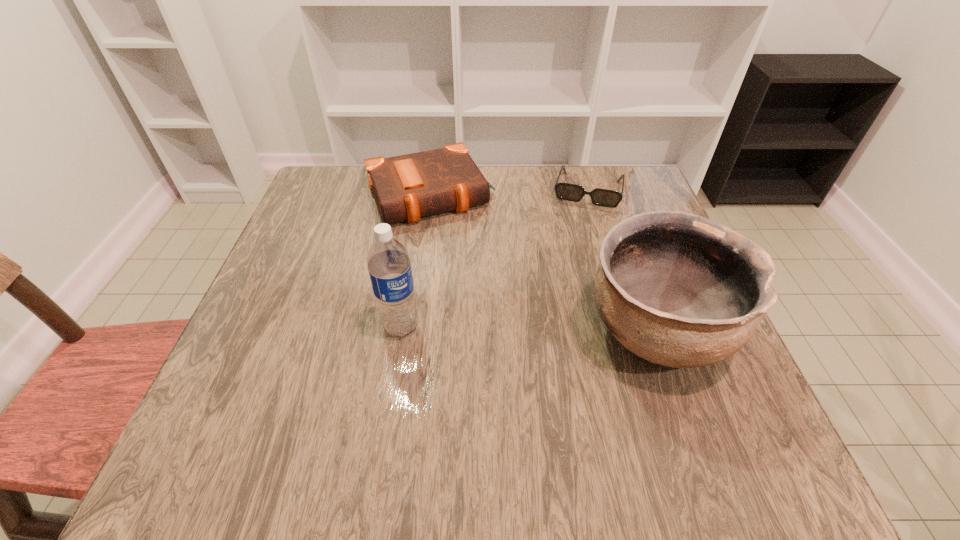
The image size is (960, 540). I want to click on object present at the near right corner, so click(677, 289).

Find the location of a particular element. The height and width of the screenshot is (540, 960). vacant space at the far edge is located at coordinates (560, 204).

At what (x,y) coordinates should I click in order to perform the action: click on vacant space at the left edge of the desktop. Please return your answer as a coordinate pair (x, y). The height and width of the screenshot is (540, 960). Looking at the image, I should click on (280, 318).

Image resolution: width=960 pixels, height=540 pixels. In the image, there is a desktop. Identify the location of vacant area at the far left corner. (341, 171).

At what (x,y) coordinates should I click in order to perform the action: click on vacant space at the near right corner of the desktop. Please return your answer as a coordinate pair (x, y). Looking at the image, I should click on (713, 413).

Where is `vacant point located between the third tallest object and the third shortest object`? vacant point located between the third tallest object and the third shortest object is located at coordinates (543, 263).

I want to click on vacant space that's between the water bottle and the sunglasses, so click(x=494, y=258).

I want to click on blank region between the second tallest object and the second shortest object, so click(543, 263).

I want to click on free spot between the sunglasses and the second shortest object, so click(x=509, y=193).

This screenshot has width=960, height=540. Find the location of `free point between the Bible and the pottery`. free point between the Bible and the pottery is located at coordinates point(543,263).